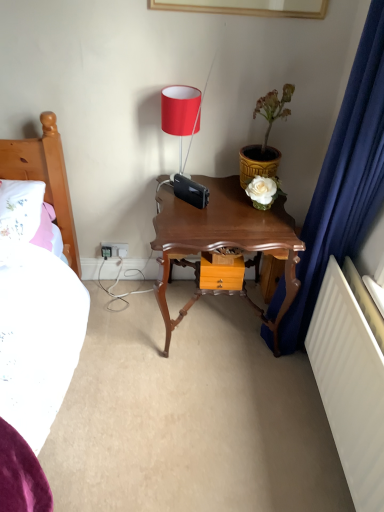
You are a GUI agent. You are given a task and a screenshot of the screen. Output one action in this format:
    pyautogui.click(x=<x>, y=<y>)
    Task: Click on the free location to the right of matte red lampshade at upper center
    
    Given the screenshot: What is the action you would take?
    pyautogui.click(x=214, y=187)